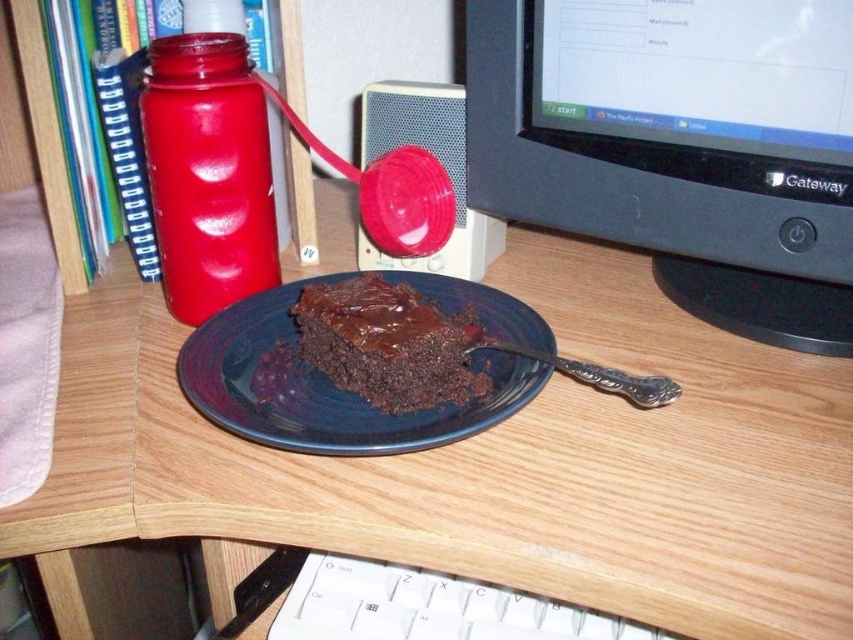
Question: Which point is closer to the camera?

Choices:
 (A) (291, 346)
 (B) (581, 376)
 (C) (239, 99)

Answer: (B)

Question: In this image, where is matte plastic bottle at left located relative to chocolate glossy cake at center?

Choices:
 (A) below
 (B) above

Answer: (B)

Question: Is matte plastic bottle at left smaller than white plastic keyboard at lower center?

Choices:
 (A) no
 (B) yes

Answer: (A)

Question: Does matte black plate at center lie behind matte plastic bottle at left?

Choices:
 (A) yes
 (B) no

Answer: (B)

Question: Which object is farther from the camera taking this photo?

Choices:
 (A) white plastic keyboard at lower center
 (B) black plastic computer monitor at center
 (C) silver metallic fork at plate right

Answer: (B)

Question: Which point is farther from the camera taking this photo?

Choices:
 (A) (512, 620)
 (B) (788, 381)
 (C) (697, 6)

Answer: (C)